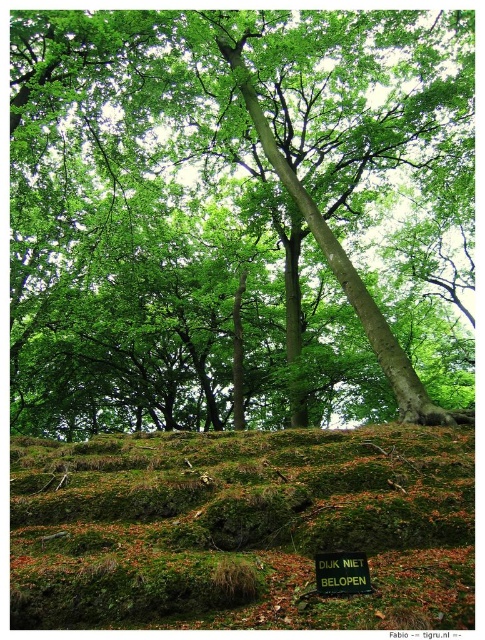
Does green leafy tree at center have a larger size compared to green mossy hillside at lower center?

Correct, green leafy tree at center is larger in size than green mossy hillside at lower center.

Does green leafy tree at center have a lesser width compared to green mossy hillside at lower center?

In fact, green leafy tree at center might be wider than green mossy hillside at lower center.

Where is `green leafy tree at center`? The width and height of the screenshot is (485, 640). green leafy tree at center is located at coordinates point(237,216).